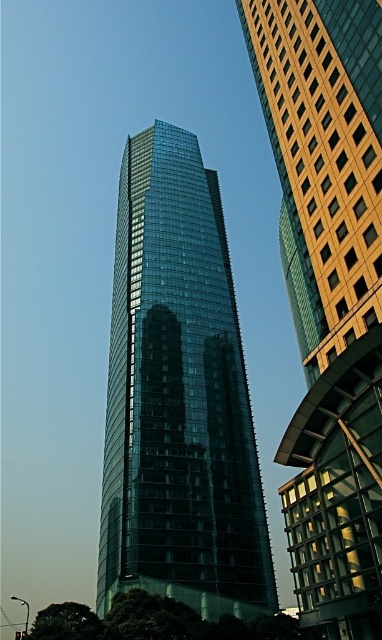
Question: Is transparent glass tower at center wider than shiny glass skyscraper at center?

Choices:
 (A) no
 (B) yes

Answer: (B)

Question: Does transparent glass tower at center have a lesser width compared to shiny glass skyscraper at center?

Choices:
 (A) yes
 (B) no

Answer: (B)

Question: Does transparent glass tower at center have a greater width compared to shiny glass skyscraper at center?

Choices:
 (A) yes
 (B) no

Answer: (A)

Question: Among these objects, which one is farthest from the camera?

Choices:
 (A) shiny glass skyscraper at center
 (B) transparent glass tower at center

Answer: (B)